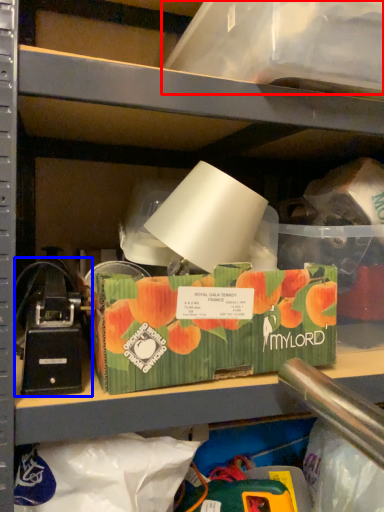
Question: Which of the following is the farthest to the observer, storage box (highlighted by a red box) or toy (highlighted by a blue box)?

Choices:
 (A) storage box
 (B) toy

Answer: (B)